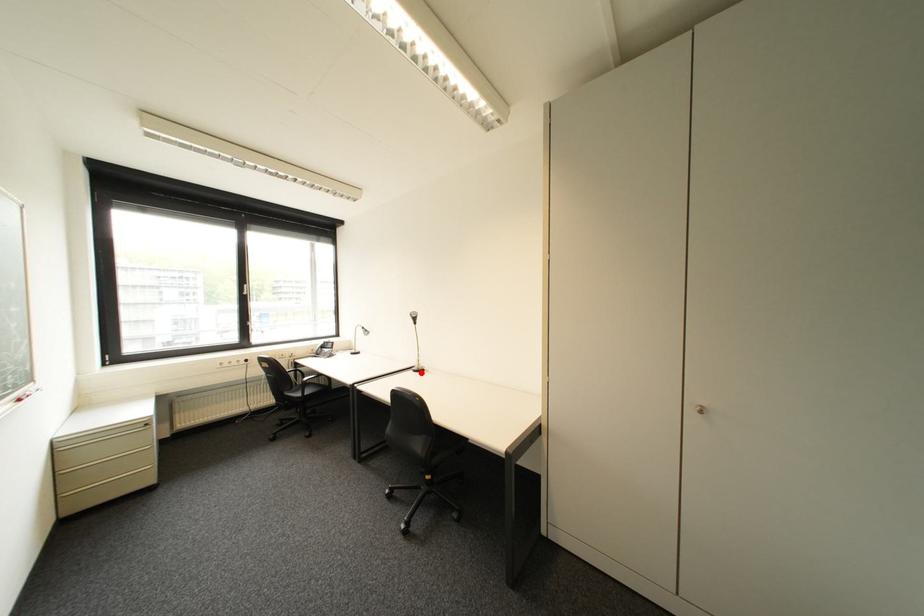
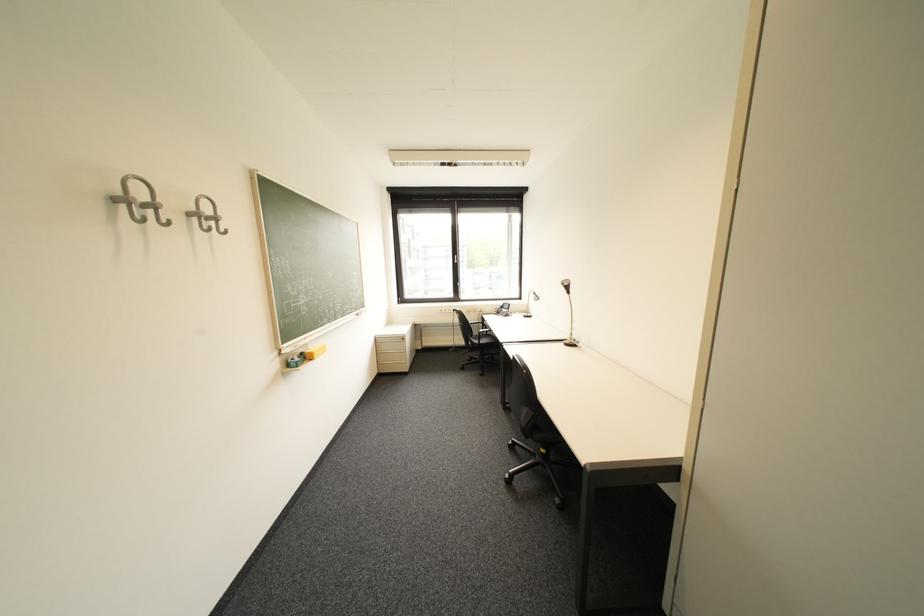
Question: I am providing you with two images of the same scene from different viewpoints. Given a red point in image1, look at the same physical point in image2. Is it:

Choices:
 (A) Closer to the viewpoint
 (B) Farther from the viewpoint

Answer: (A)